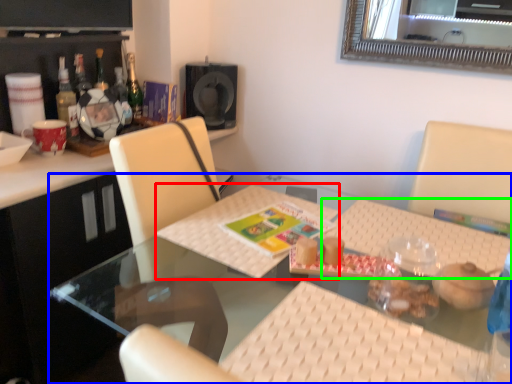
Question: Based on their relative distances, which object is nearer to place mat (highlighted by a red box)? Choose from table (highlighted by a blue box) and place mat (highlighted by a green box).

Choices:
 (A) table
 (B) place mat

Answer: (A)